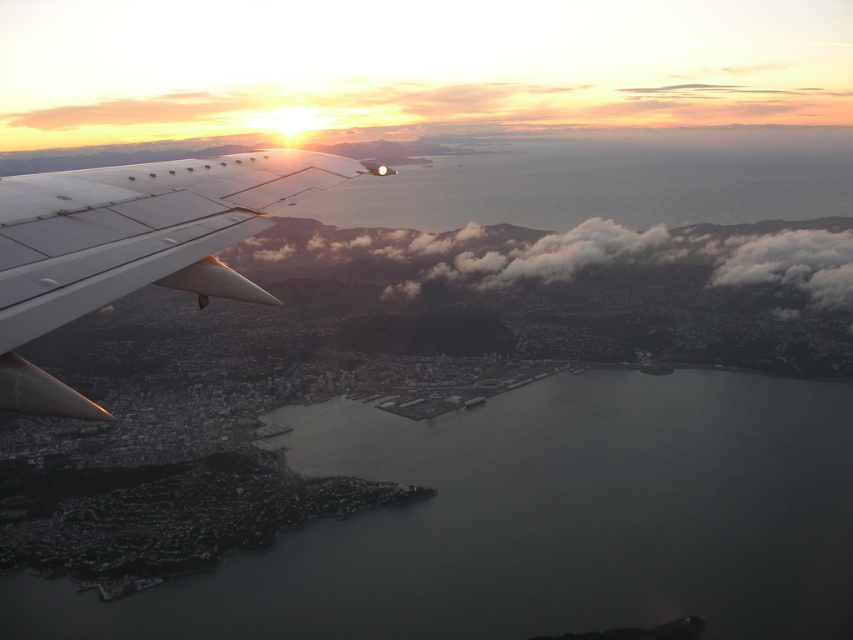
You are a passenger on an airplane and want to know the distance between your current position and the point marked at coordinates (802,499) in the image. Can you determine this distance using the information provided?

The point at coordinates (802,499) is 668.53 meters away from the viewer, so the distance between your current position and the point is 668.53 meters.

You are a passenger on an airplane and looking out the window. You see a metallic gray wing at left and white fluffy clouds at center. Which object appears smaller in the window view?

The metallic gray wing at left appears smaller than the white fluffy clouds at center in the window view.

You are a passenger sitting in the airplane and looking out the window. You notice two points in the sky below the wing. Which point is closer to you, point 1 at coordinates [479,568] or point 2 at coordinates [305,192]?

Point 1 at coordinates [479,568] is closer to you because it is further to the viewer than point 2 at coordinates [305,192].